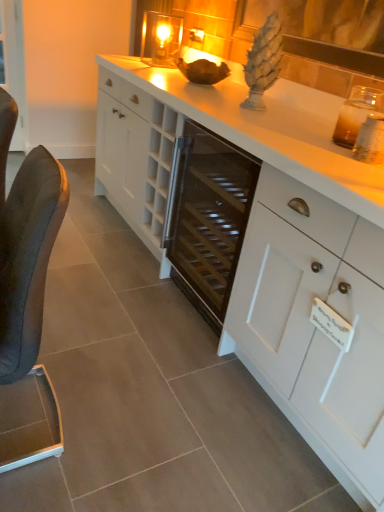
Question: Is black leather chair at left situated inside clear glass candle at upper center or outside?

Choices:
 (A) outside
 (B) inside

Answer: (A)

Question: Looking at the image, does black leather chair at left seem bigger or smaller compared to clear glass candle at upper center?

Choices:
 (A) big
 (B) small

Answer: (A)

Question: Based on their relative distances, which object is farther from the black leather chair at left?

Choices:
 (A) clear glass candle at upper center
 (B) white matte cabinet at center
 (C) transparent glass door at left
 (D) white glossy countertop at center

Answer: (C)

Question: Which object is positioned farthest from the white glossy countertop at center?

Choices:
 (A) clear glass candle at upper center
 (B) white matte cabinet at center
 (C) black leather chair at left
 (D) transparent glass door at left

Answer: (D)